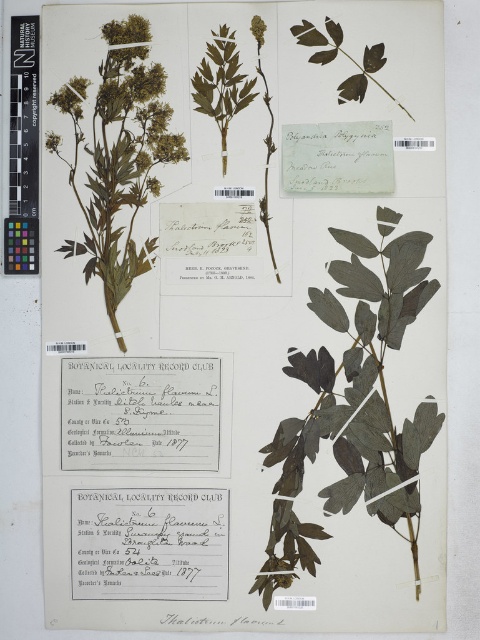
Can you confirm if dark green leafy plant at center is positioned below green matte herb at center?

Yes.

Which of these two, dark green leafy plant at center or green matte herb at center, stands shorter?

green matte herb at center is shorter.

The height and width of the screenshot is (640, 480). I want to click on dark green leafy plant at center, so click(x=354, y=404).

Image resolution: width=480 pixels, height=640 pixels. In order to click on dark green leafy plant at center in this screenshot , I will do `click(354, 404)`.

Who is more forward, (98, 92) or (228, 42)?

Point (228, 42) is more forward.

Between point (86, 104) and point (227, 156), which one is positioned in front?

Point (86, 104) is more forward.

In order to click on greenish-yellow herbaceous plant at upper left in this screenshot , I will do `click(118, 156)`.

Does dark green leafy plant at center have a greater width compared to greenish-yellow herbaceous plant at upper left?

Indeed, dark green leafy plant at center has a greater width compared to greenish-yellow herbaceous plant at upper left.

Does point (388, 317) lie in front of point (79, 244)?

No, it is behind (79, 244).

Which is in front, point (396, 305) or point (149, 42)?

Point (149, 42) is more forward.

Find the location of a particular element. The image size is (480, 640). dark green leafy plant at center is located at coordinates (354, 404).